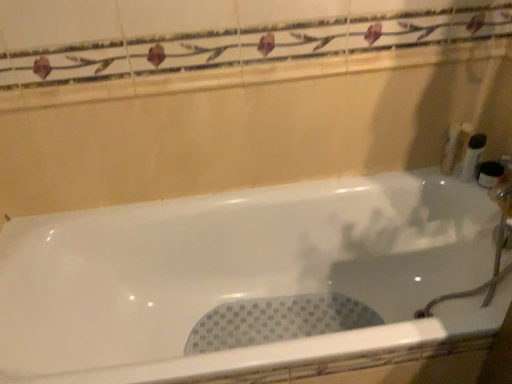
Identify the location of white plastic bottle at right, arranged as the 3th toiletry when viewed from the left. (473, 156).

What do you see at coordinates (490, 174) in the screenshot?
I see `white plastic bottle at right, the 1th toiletry from the right` at bounding box center [490, 174].

How much space does white plastic bottle at right, which is the fourth toiletry from left to right, occupy vertically?

white plastic bottle at right, which is the fourth toiletry from left to right, is 3.84 inches tall.

What are the coordinates of `white glossy bathtub at center` in the screenshot? It's located at (249, 283).

Is white plastic bottle at right, which is the second toiletry in right-to-left order, with white plastic bottle at right, which is the fourth toiletry from left to right?

Yes, white plastic bottle at right, which is the second toiletry in right-to-left order, is next to white plastic bottle at right, which is the fourth toiletry from left to right.

From a real-world perspective, between white plastic bottle at right, which is the second toiletry in right-to-left order, and white plastic bottle at right, which is the fourth toiletry from left to right, who is vertically higher?

white plastic bottle at right, which is the second toiletry in right-to-left order, is physically above.

Considering the positions of objects white plastic bottle at right, arranged as the 3th toiletry when viewed from the left, and white plastic bottle at right, the 1th toiletry from the right, in the image provided, who is behind, white plastic bottle at right, arranged as the 3th toiletry when viewed from the left, or white plastic bottle at right, the 1th toiletry from the right,?

white plastic bottle at right, arranged as the 3th toiletry when viewed from the left, is more distant.

Could you measure the distance between white plastic bottle at right, arranged as the 3th toiletry when viewed from the left, and white plastic bottle at right, the 1th toiletry from the right?

white plastic bottle at right, arranged as the 3th toiletry when viewed from the left, and white plastic bottle at right, the 1th toiletry from the right, are 2.24 inches apart.

Does white plastic bottle at right, which is the fourth toiletry from left to right, have a greater width compared to white plastic bottle at right, arranged as the 3th toiletry when viewed from the left?

Correct, the width of white plastic bottle at right, which is the fourth toiletry from left to right, exceeds that of white plastic bottle at right, arranged as the 3th toiletry when viewed from the left.

From the image's perspective, is white plastic bottle at right, the 1th toiletry from the right, beneath white plastic bottle at right, arranged as the 3th toiletry when viewed from the left?

Correct, white plastic bottle at right, the 1th toiletry from the right, appears lower than white plastic bottle at right, arranged as the 3th toiletry when viewed from the left, in the image.

Is white plastic bottle at right, which is the fourth toiletry from left to right, turned away from white plastic bottle at right, arranged as the 3th toiletry when viewed from the left?

white plastic bottle at right, which is the fourth toiletry from left to right, is not turned away from white plastic bottle at right, arranged as the 3th toiletry when viewed from the left.

From a real-world perspective, which object stands above the other?

In real-world perspective, white plastic bottle at right, which is the second toiletry in right-to-left order, is above.

In order to click on the 1st toiletry to the right of the white glossy bathtub at center, counting from the anchor's position in this screenshot , I will do `click(450, 149)`.

From the image's perspective, between white glossy bathtub at center and white plastic bottle at right, placed as the 1th toiletry when sorted from left to right, who is located below?

white glossy bathtub at center.

Which object is closer to the camera, white glossy bathtub at center or white plastic bottle at right, placed as the 1th toiletry when sorted from left to right?

white glossy bathtub at center is closer to the camera.

Is white plastic bottle at right, placed as the 1th toiletry when sorted from left to right, completely or partially inside white glossy bathtub at center?

No, white plastic bottle at right, placed as the 1th toiletry when sorted from left to right, is not a part of white glossy bathtub at center.

Is white glossy bathtub at center positioned with its back to white plastic container at right, the third toiletry in the right-to-left sequence?

No, white plastic container at right, the third toiletry in the right-to-left sequence, is not at the back of white glossy bathtub at center.

Is white glossy bathtub at center not within white plastic container at right, the third toiletry in the right-to-left sequence?

white glossy bathtub at center lies outside white plastic container at right, the third toiletry in the right-to-left sequence,'s area.

From a real-world perspective, which is physically below, white glossy bathtub at center or white plastic container at right, the 2th toiletry in the left-to-right sequence?

From a 3D spatial view, white glossy bathtub at center is below.

How many degrees apart are the facing directions of white glossy bathtub at center and white plastic container at right, the third toiletry in the right-to-left sequence?

21.3 degrees.

From a real-world perspective, who is located lower, white plastic container at right, the 2th toiletry in the left-to-right sequence, or white plastic bottle at right, which is the fourth toiletry from left to right?

In real-world perspective, white plastic bottle at right, which is the fourth toiletry from left to right, is lower.

Based on the photo, is white plastic container at right, the third toiletry in the right-to-left sequence, outside of white plastic bottle at right, which is the fourth toiletry from left to right?

Absolutely, white plastic container at right, the third toiletry in the right-to-left sequence, is external to white plastic bottle at right, which is the fourth toiletry from left to right.

Does white plastic container at right, the 2th toiletry in the left-to-right sequence, have a greater height compared to white plastic bottle at right, which is the fourth toiletry from left to right?

Correct, white plastic container at right, the 2th toiletry in the left-to-right sequence, is much taller as white plastic bottle at right, which is the fourth toiletry from left to right.

Which is nearer, [468,126] or [497,182]?

Positioned in front is point [497,182].

Is white plastic bottle at right, placed as the 1th toiletry when sorted from left to right, far from white plastic bottle at right, the 1th toiletry from the right?

No, white plastic bottle at right, placed as the 1th toiletry when sorted from left to right, is not far away from white plastic bottle at right, the 1th toiletry from the right.

Is white plastic bottle at right, which is the fourth toiletry from left to right, at the back of white plastic bottle at right, the fourth toiletry from the right?

No, white plastic bottle at right, the fourth toiletry from the right, is not facing the opposite direction of white plastic bottle at right, which is the fourth toiletry from left to right.

Is white plastic bottle at right, the fourth toiletry from the right, to the left of white plastic bottle at right, which is the fourth toiletry from left to right, from the viewer's perspective?

Yes.

Does point (451, 162) come behind point (496, 185)?

Yes.

Considering the relative sizes of white plastic bottle at right, the fourth toiletry from the right, and white glossy bathtub at center in the image provided, is white plastic bottle at right, the fourth toiletry from the right, thinner than white glossy bathtub at center?

Yes.

From a real-world perspective, which is physically above, white plastic bottle at right, placed as the 1th toiletry when sorted from left to right, or white glossy bathtub at center?

white plastic bottle at right, placed as the 1th toiletry when sorted from left to right.

From the image's perspective, is white plastic bottle at right, the fourth toiletry from the right, above or below white glossy bathtub at center?

From the image's perspective, white plastic bottle at right, the fourth toiletry from the right, appears above white glossy bathtub at center.

Which toiletry is the 1st one when counting from the left side of the white plastic bottle at right, which is the fourth toiletry from left to right? Please provide its 2D coordinates.

[(473, 156)]

Where is `the 1st toiletry behind when counting from the white plastic bottle at right, the 1th toiletry from the right`? the 1st toiletry behind when counting from the white plastic bottle at right, the 1th toiletry from the right is located at coordinates (473, 156).

Based on their spatial positions, is white plastic bottle at right, which is the second toiletry in right-to-left order, or white plastic bottle at right, the fourth toiletry from the right, further from white plastic bottle at right, which is the fourth toiletry from left to right?

white plastic bottle at right, the fourth toiletry from the right.

Which object lies further to the anchor point white plastic bottle at right, the 1th toiletry from the right, white plastic bottle at right, which is the second toiletry in right-to-left order, or white plastic container at right, the 2th toiletry in the left-to-right sequence?

white plastic container at right, the 2th toiletry in the left-to-right sequence.

Which object lies nearer to the anchor point white plastic bottle at right, the fourth toiletry from the right, white glossy bathtub at center or white plastic container at right, the third toiletry in the right-to-left sequence?

white plastic container at right, the third toiletry in the right-to-left sequence, is closer to white plastic bottle at right, the fourth toiletry from the right.

When comparing their distances from white plastic bottle at right, arranged as the 3th toiletry when viewed from the left, does white glossy bathtub at center or white plastic bottle at right, the fourth toiletry from the right, seem closer?

white plastic bottle at right, the fourth toiletry from the right, is closer to white plastic bottle at right, arranged as the 3th toiletry when viewed from the left.

Estimate the real-world distances between objects in this image. Which object is further from white plastic bottle at right, placed as the 1th toiletry when sorted from left to right, white plastic bottle at right, which is the second toiletry in right-to-left order, or white glossy bathtub at center?

Among the two, white glossy bathtub at center is located further to white plastic bottle at right, placed as the 1th toiletry when sorted from left to right.

Based on the photo, estimate the real-world distances between objects in this image. Which object is further from white glossy bathtub at center, white plastic bottle at right, arranged as the 3th toiletry when viewed from the left, or white plastic bottle at right, the 1th toiletry from the right?

Among the two, white plastic bottle at right, the 1th toiletry from the right, is located further to white glossy bathtub at center.

Which object lies nearer to the anchor point white plastic bottle at right, which is the fourth toiletry from left to right, white glossy bathtub at center or white plastic bottle at right, the fourth toiletry from the right?

Based on the image, white plastic bottle at right, the fourth toiletry from the right, appears to be nearer to white plastic bottle at right, which is the fourth toiletry from left to right.

Looking at the image, which one is located further to white plastic bottle at right, placed as the 1th toiletry when sorted from left to right, white plastic container at right, the 2th toiletry in the left-to-right sequence, or white glossy bathtub at center?

white glossy bathtub at center is positioned further to the anchor white plastic bottle at right, placed as the 1th toiletry when sorted from left to right.

At what (x,y) coordinates should I click in order to perform the action: click on toiletry situated between white glossy bathtub at center and white plastic container at right, the 2th toiletry in the left-to-right sequence, from left to right. Please return your answer as a coordinate pair (x, y). The height and width of the screenshot is (384, 512). Looking at the image, I should click on (450, 149).

This screenshot has height=384, width=512. What are the coordinates of `toiletry between white plastic container at right, the 2th toiletry in the left-to-right sequence, and white plastic bottle at right, arranged as the 3th toiletry when viewed from the left, from top to bottom` in the screenshot? It's located at (450, 149).

Find the location of a particular element. The width and height of the screenshot is (512, 384). toiletry between white plastic bottle at right, placed as the 1th toiletry when sorted from left to right, and white plastic bottle at right, which is the fourth toiletry from left to right, in the up-down direction is located at coordinates (473, 156).